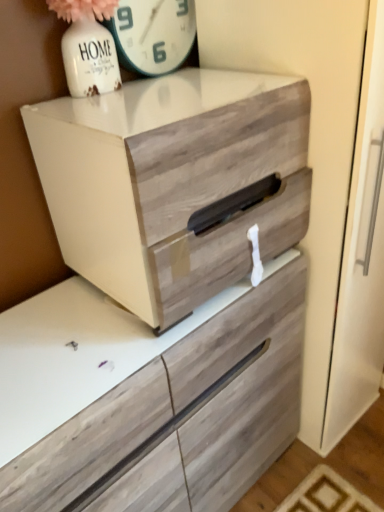
Question: Is white glossy clock at upper center shorter than wooden drawer at center?

Choices:
 (A) yes
 (B) no

Answer: (A)

Question: From a real-world perspective, does white glossy clock at upper center stand above wooden drawer at center?

Choices:
 (A) yes
 (B) no

Answer: (A)

Question: Does white glossy clock at upper center appear on the right side of wooden drawer at center?

Choices:
 (A) no
 (B) yes

Answer: (A)

Question: Is white glossy clock at upper center touching wooden drawer at center?

Choices:
 (A) no
 (B) yes

Answer: (A)

Question: Does white glossy clock at upper center turn towards wooden drawer at center?

Choices:
 (A) no
 (B) yes

Answer: (A)

Question: From the image's perspective, is white glossy clock at upper center under wooden drawer at center?

Choices:
 (A) no
 (B) yes

Answer: (A)

Question: Can you confirm if wooden drawer at center is positioned to the left of white glossy clock at upper center?

Choices:
 (A) no
 (B) yes

Answer: (A)

Question: Is wooden drawer at center shorter than white glossy clock at upper center?

Choices:
 (A) no
 (B) yes

Answer: (A)

Question: Is wooden drawer at center next to white glossy clock at upper center?

Choices:
 (A) yes
 (B) no

Answer: (B)

Question: From a real-world perspective, is wooden drawer at center physically below white glossy clock at upper center?

Choices:
 (A) yes
 (B) no

Answer: (A)

Question: Is wooden drawer at center completely or partially outside of white glossy clock at upper center?

Choices:
 (A) no
 (B) yes

Answer: (B)

Question: Considering the relative positions of wooden drawer at center and white glossy clock at upper center in the image provided, is wooden drawer at center behind white glossy clock at upper center?

Choices:
 (A) yes
 (B) no

Answer: (B)

Question: Would you say white glossy clock at upper center is inside or outside wooden drawer at center?

Choices:
 (A) inside
 (B) outside

Answer: (B)